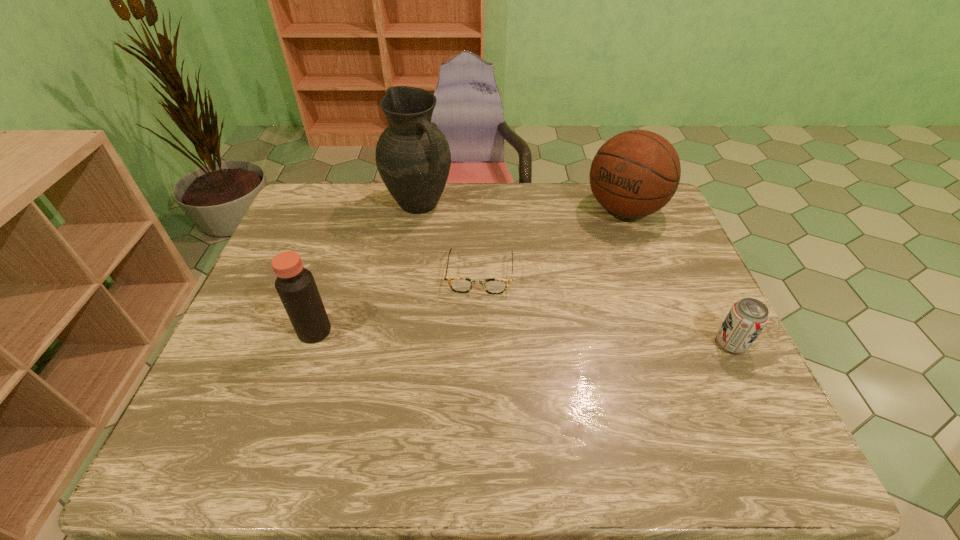
Where is `object that is the third closest to the vinegar`? Image resolution: width=960 pixels, height=540 pixels. object that is the third closest to the vinegar is located at coordinates (635, 173).

Locate an element on the screen. The width and height of the screenshot is (960, 540). free space that satisfies the following two spatial constraints: 1. on the back side of the third nearest object; 2. on the left side of the leftmost object is located at coordinates [x=333, y=275].

In order to click on free region that satisfies the following two spatial constraints: 1. on the back side of the vinegar; 2. on the left side of the basketball in this screenshot , I will do `click(355, 210)`.

The image size is (960, 540). In order to click on free space that satisfies the following two spatial constraints: 1. on the front side of the pitcher; 2. on the left side of the third farthest object in this screenshot , I will do [407, 275].

You are a GUI agent. You are given a task and a screenshot of the screen. Output one action in this format:
    pyautogui.click(x=<x>, y=<y>)
    Task: Click on the free space that satisfies the following two spatial constraints: 1. on the back side of the vinegar; 2. on the left side of the third nearest object
    This screenshot has width=960, height=540.
    Given the screenshot: What is the action you would take?
    pyautogui.click(x=333, y=275)

At what (x,y) coordinates should I click in order to perform the action: click on vacant region that satisfies the following two spatial constraints: 1. on the front side of the leftmost object; 2. on the left side of the fourth tallest object. Please return your answer as a coordinate pair (x, y). Looking at the image, I should click on (310, 344).